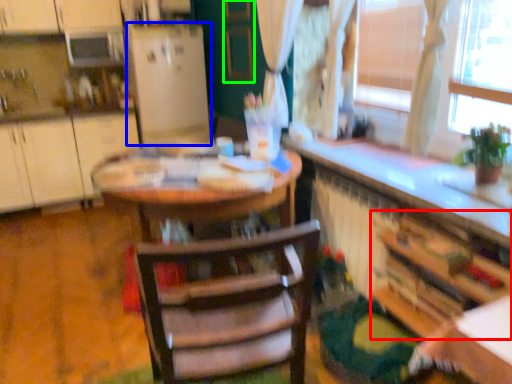
Question: Which is nearer to the cabinetry (highlighted by a red box)? fridge (highlighted by a blue box) or screen door (highlighted by a green box).

Choices:
 (A) fridge
 (B) screen door

Answer: (B)